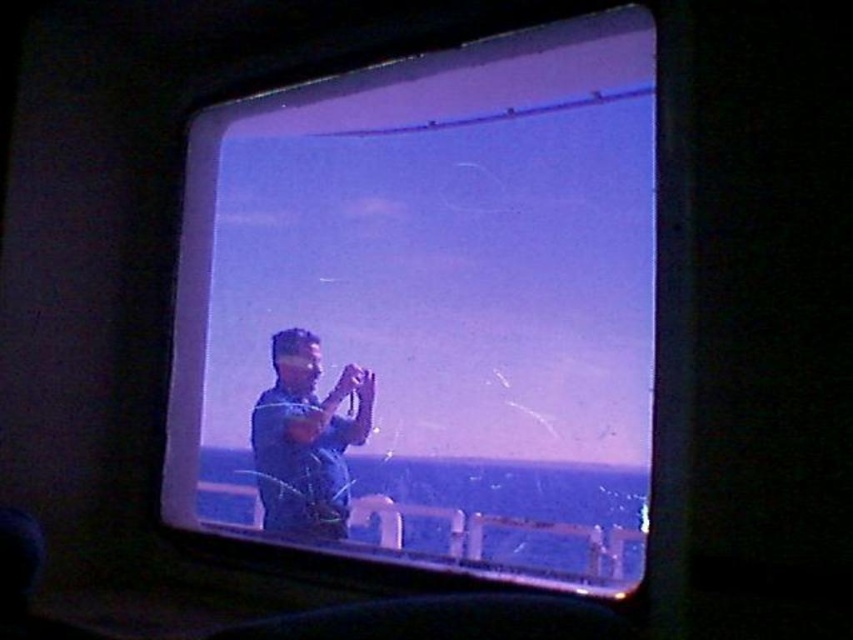
Who is taller, transparent glass airplane window at center or blue fabric shirt at center?

transparent glass airplane window at center is taller.

Does transparent glass airplane window at center have a greater height compared to blue fabric shirt at center?

Correct, transparent glass airplane window at center is much taller as blue fabric shirt at center.

This screenshot has width=853, height=640. What are the coordinates of `transparent glass airplane window at center` in the screenshot? It's located at (428, 308).